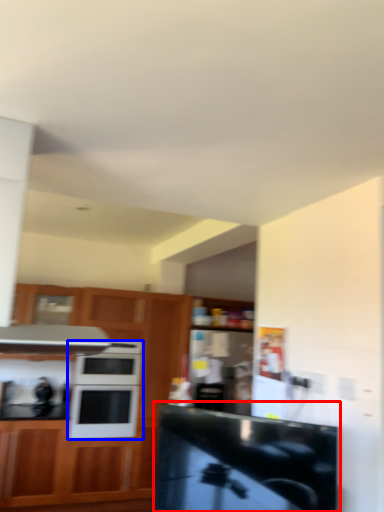
Question: Which of the following is the farthest to the observer, counter top (highlighted by a red box) or microwave oven (highlighted by a blue box)?

Choices:
 (A) counter top
 (B) microwave oven

Answer: (B)